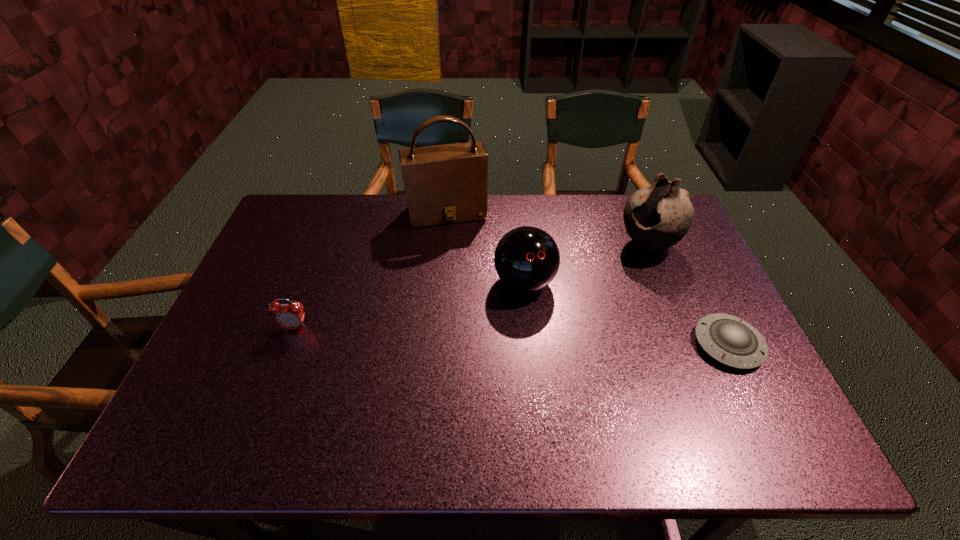
Where is `the leftmost object`? This screenshot has width=960, height=540. the leftmost object is located at coordinates (290, 316).

The height and width of the screenshot is (540, 960). I want to click on alarm clock, so click(x=290, y=316).

I want to click on the shortest object, so click(730, 340).

This screenshot has width=960, height=540. I want to click on shoulder bag, so click(x=448, y=183).

Identify the location of the fourth object from right to left. The height and width of the screenshot is (540, 960). (448, 183).

At what (x,y) coordinates should I click in order to perform the action: click on the third object from left to right. Please return your answer as a coordinate pair (x, y). The width and height of the screenshot is (960, 540). Looking at the image, I should click on (526, 259).

Identify the location of the third tallest object. The image size is (960, 540). (526, 259).

At what (x,y) coordinates should I click in order to perform the action: click on the fourth shortest object. Please return your answer as a coordinate pair (x, y). The width and height of the screenshot is (960, 540). Looking at the image, I should click on (658, 216).

Locate an element on the screen. This screenshot has width=960, height=540. free space located 0.150m on the face of the alarm clock is located at coordinates (274, 384).

At what (x,y) coordinates should I click in order to perform the action: click on blank space located 0.130m on the left of the saucer. Please return your answer as a coordinate pair (x, y). Looking at the image, I should click on (643, 345).